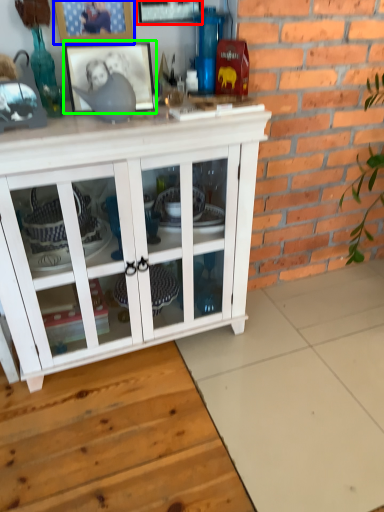
Question: Which is farther away from picture frame (highlighted by a red box)? picture frame (highlighted by a blue box) or picture frame (highlighted by a green box)?

Choices:
 (A) picture frame
 (B) picture frame

Answer: (B)